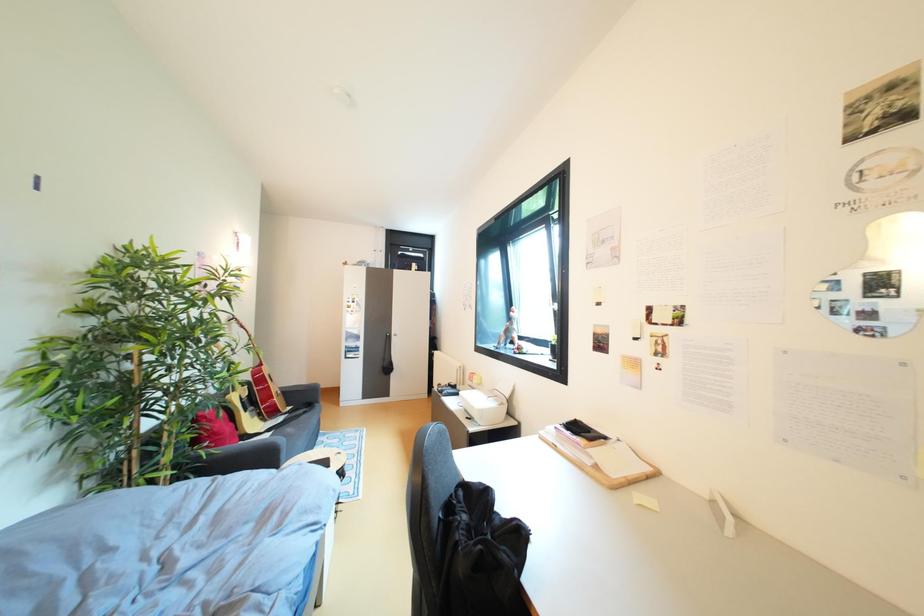
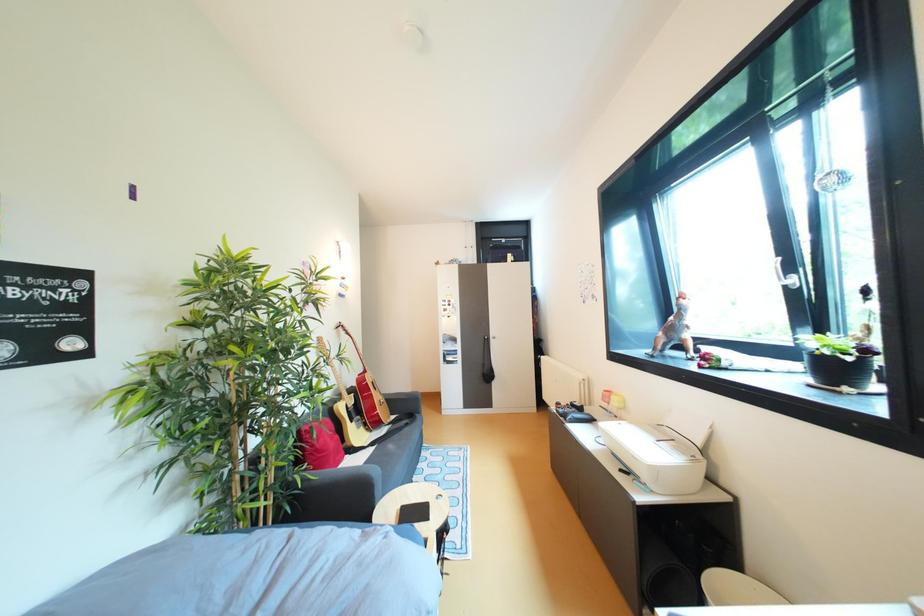
In a continuous first-person perspective shot, in which direction is the camera moving?

The cameraman walked toward left, forward.